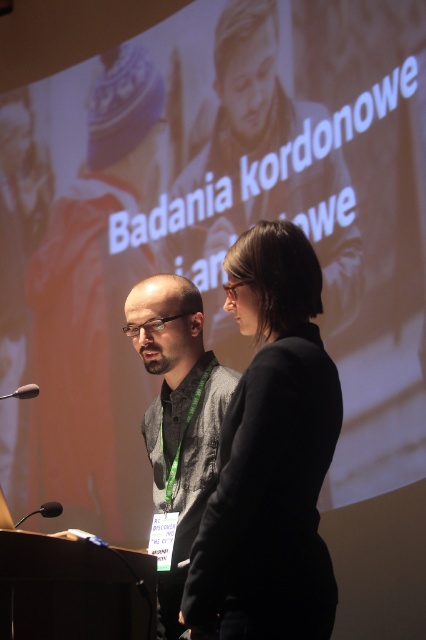
You are a photographer at a conference. You need to take a photo of both the black fabric jacket at center and dark gray textured shirt at center. The camera you have can only focus on objects within a 25 inch range. Will both subjects be in focus?

The distance between black fabric jacket at center and dark gray textured shirt at center is 26.03 inches, which exceeds the camera focus range of 25 inches. Therefore, both subjects cannot be in focus simultaneously.

You are an event photographer at the conference. You need to capture a photo where the black fabric jacket at center and the black matte microphone at lower left are both visible. Based on their positions, which object should be placed on the left side of the photo to ensure both are in frame?

The black matte microphone at lower left should be placed on the left side of the photo since the black fabric jacket at center is to the right of it, ensuring both are visible in the frame.

You are an attendee at the conference and want to take a photo of the presentation. The two points on the screen are important for your notes. Which point is closer to you, point at position (279, 403) or point at position (195, 388)?

Point at position (279, 403) is closer to you than point at position (195, 388).